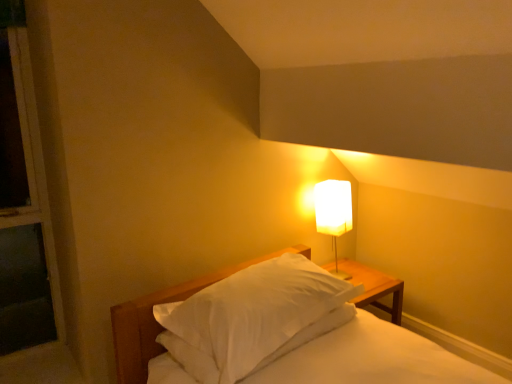
Image resolution: width=512 pixels, height=384 pixels. Identify the location of white soft pillow at center. 253,317.

Find the location of a particular element. The width and height of the screenshot is (512, 384). white matte bed at center is located at coordinates (158, 324).

Is white fabric lampshade at upper right beside white matte bed at center?

No, white fabric lampshade at upper right is not in contact with white matte bed at center.

Which object is positioned more to the left, white fabric lampshade at upper right or white matte bed at center?

white matte bed at center is more to the left.

I want to click on lamp behind the white matte bed at center, so click(334, 214).

Does white matte bed at center turn towards white soft pillow at center?

No, white matte bed at center is not oriented towards white soft pillow at center.

Between white matte bed at center and white soft pillow at center, which one has larger size?

Bigger between the two is white matte bed at center.

From the image's perspective, who appears lower, white matte bed at center or white soft pillow at center?

white matte bed at center.

Identify the location of pillow behind the white matte bed at center. (253, 317).

Is point (294, 281) positioned in front of point (329, 220)?

Yes, it is.

Is white soft pillow at center facing towards white fabric lampshade at upper right?

Yes, white soft pillow at center is oriented towards white fabric lampshade at upper right.

Between white soft pillow at center and white fabric lampshade at upper right, which one has less height?

white soft pillow at center.

Based on their sizes in the image, would you say white fabric lampshade at upper right is bigger or smaller than white soft pillow at center?

In the image, white fabric lampshade at upper right appears to be smaller than white soft pillow at center.

Can we say white fabric lampshade at upper right lies outside white soft pillow at center?

white fabric lampshade at upper right is positioned outside white soft pillow at center.

Considering the sizes of objects white fabric lampshade at upper right and white soft pillow at center in the image provided, who is thinner, white fabric lampshade at upper right or white soft pillow at center?

white fabric lampshade at upper right is thinner.

Locate an element on the screen. The width and height of the screenshot is (512, 384). pillow that appears in front of the white fabric lampshade at upper right is located at coordinates (253, 317).

Does white soft pillow at center have a greater width compared to white matte bed at center?

No, white soft pillow at center is not wider than white matte bed at center.

Which is more to the left, white soft pillow at center or white matte bed at center?

Positioned to the left is white soft pillow at center.

Who is more distant, white soft pillow at center or white matte bed at center?

white soft pillow at center is behind.

Locate an element on the screen. Image resolution: width=512 pixels, height=384 pixels. pillow positioned vertically above the white matte bed at center (from a real-world perspective) is located at coordinates (253, 317).

From the image's perspective, does white matte bed at center appear lower than white fabric lampshade at upper right?

Correct, white matte bed at center appears lower than white fabric lampshade at upper right in the image.

Is white matte bed at center thinner than white fabric lampshade at upper right?

In fact, white matte bed at center might be wider than white fabric lampshade at upper right.

Could you tell me if white matte bed at center is turned towards white fabric lampshade at upper right?

No, white matte bed at center is not oriented towards white fabric lampshade at upper right.

Is white matte bed at center positioned beyond the bounds of white fabric lampshade at upper right?

That's correct, white matte bed at center is outside of white fabric lampshade at upper right.

Identify the location of bed below the white fabric lampshade at upper right (from the image's perspective). Image resolution: width=512 pixels, height=384 pixels. (158, 324).

The width and height of the screenshot is (512, 384). Identify the location of pillow lying above the white matte bed at center (from the image's perspective). click(253, 317).

Looking at the image, which one is located closer to white matte bed at center, white fabric lampshade at upper right or white soft pillow at center?

Based on the image, white soft pillow at center appears to be nearer to white matte bed at center.

Considering their positions, is white matte bed at center positioned closer to white soft pillow at center than white fabric lampshade at upper right?

Among the two, white matte bed at center is located nearer to white soft pillow at center.

Which object lies further to the anchor point white fabric lampshade at upper right, white soft pillow at center or white matte bed at center?

white soft pillow at center.

From the image, which object appears to be nearer to white fabric lampshade at upper right, white matte bed at center or white soft pillow at center?

white matte bed at center is closer to white fabric lampshade at upper right.

Based on their spatial positions, is white fabric lampshade at upper right or white matte bed at center further from white soft pillow at center?

The object further to white soft pillow at center is white fabric lampshade at upper right.

When comparing their distances from white matte bed at center, does white soft pillow at center or white fabric lampshade at upper right seem closer?

white soft pillow at center lies closer to white matte bed at center than the other object.

This screenshot has width=512, height=384. What are the coordinates of `pillow between white matte bed at center and white fabric lampshade at upper right in the front-back direction` in the screenshot? It's located at [253, 317].